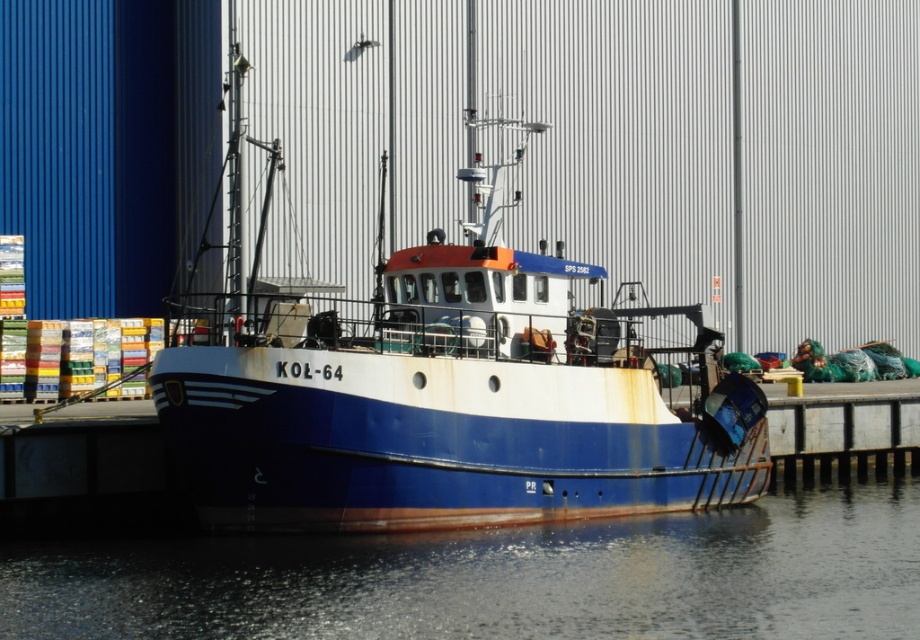
Between blue matte boat at center and glossy water at lower center, which one appears on the left side from the viewer's perspective?

From the viewer's perspective, blue matte boat at center appears more on the left side.

Which of these two, blue matte boat at center or glossy water at lower center, stands taller?

With more height is blue matte boat at center.

Is point (395, 454) farther from camera compared to point (899, 531)?

No, (395, 454) is in front of (899, 531).

Identify the location of blue matte boat at center. The height and width of the screenshot is (640, 920). (461, 396).